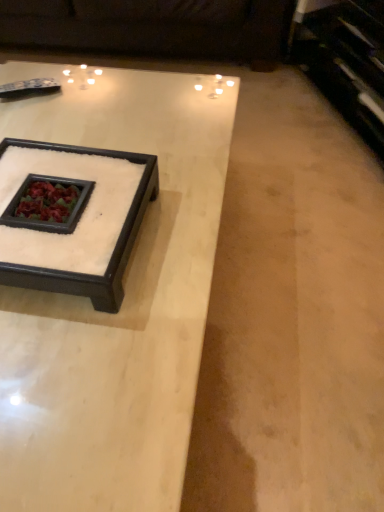
Find the location of `vacant area in front of white marble tray at center, acting as the second coffee table starting from the front`. vacant area in front of white marble tray at center, acting as the second coffee table starting from the front is located at coordinates (83, 381).